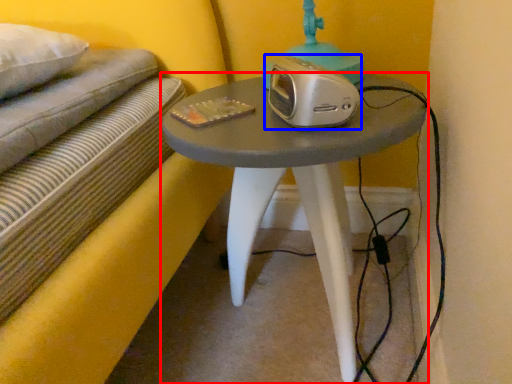
Question: Which point is further to the camera, table (highlighted by a red box) or stereo (highlighted by a blue box)?

Choices:
 (A) table
 (B) stereo

Answer: (B)